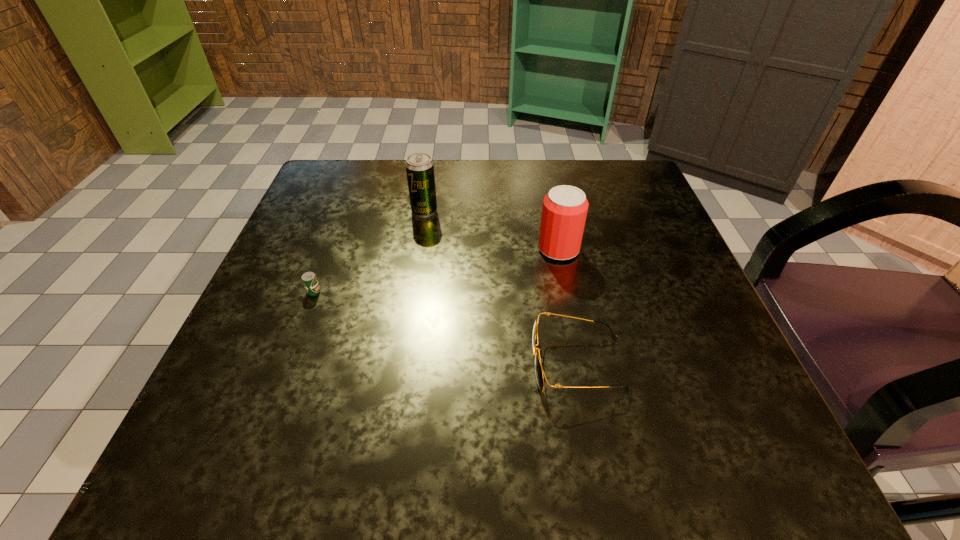
This screenshot has height=540, width=960. Find the location of `vacant space positioned 0.130m on the lenses of the third tallest object`. vacant space positioned 0.130m on the lenses of the third tallest object is located at coordinates (443, 363).

In order to click on free space located on the lenses of the third tallest object in this screenshot , I will do [x=325, y=363].

This screenshot has height=540, width=960. In order to click on vacant space situated on the lenses of the third tallest object in this screenshot , I will do `click(257, 363)`.

Locate an element on the screen. Image resolution: width=960 pixels, height=540 pixels. free space located 0.050m on the back of the leftmost object is located at coordinates (328, 253).

Image resolution: width=960 pixels, height=540 pixels. I want to click on object at the far edge, so click(x=419, y=166).

Identify the location of object that is positioned at the left edge. This screenshot has width=960, height=540. (309, 279).

Locate an element on the screen. This screenshot has width=960, height=540. object that is positioned at the right edge is located at coordinates (539, 373).

Locate an element on the screen. vacant space at the far edge is located at coordinates (453, 178).

This screenshot has height=540, width=960. Find the location of `vacant space at the near edge of the desktop`. vacant space at the near edge of the desktop is located at coordinates (525, 426).

Where is `vacant space at the left edge of the desktop`? This screenshot has width=960, height=540. vacant space at the left edge of the desktop is located at coordinates (277, 357).